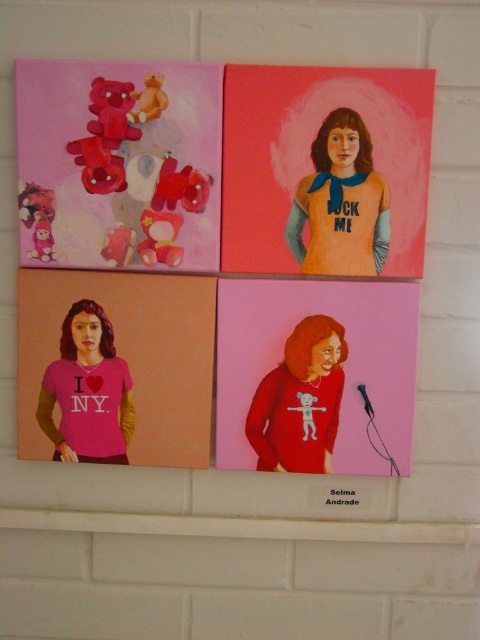
Question: Which of the following is the closest to the observer?

Choices:
 (A) pink matte t-shirt at lower left
 (B) matte blue fabric shirt at upper center
 (C) matte red sweater at center
 (D) pink matte t-shirt at center-left

Answer: (B)

Question: Can you confirm if orange matte shirt at upper center is positioned above matte plastic teddy bears at upper left?

Choices:
 (A) no
 (B) yes

Answer: (A)

Question: Does matte red sweater at lower right have a larger size compared to black plastic microphone at lower right?

Choices:
 (A) no
 (B) yes

Answer: (B)

Question: Which of the following is the closest to the observer?

Choices:
 (A) (106, 344)
 (B) (220, 72)
 (C) (112, 292)

Answer: (B)

Question: Among these objects, which one is farthest from the camera?

Choices:
 (A) orange matte shirt at upper center
 (B) matte blue fabric shirt at upper center
 (C) matte red sweater at center

Answer: (C)

Question: Does pink matte t-shirt at center-left have a greater width compared to matte red sweater at lower right?

Choices:
 (A) yes
 (B) no

Answer: (A)